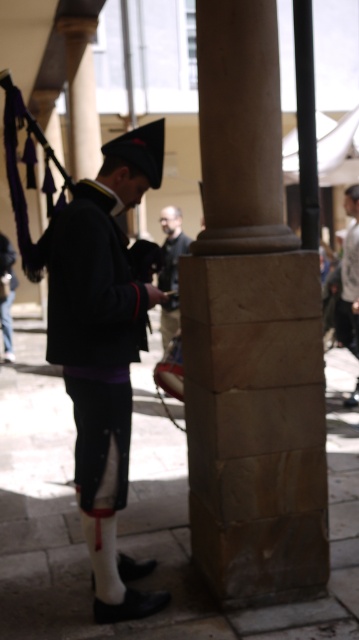
Question: Which point is closer to the camera taking this photo?

Choices:
 (A) (171, 244)
 (B) (258, 172)
 (C) (310, 230)

Answer: (B)

Question: Is brown stone pillar at center positioned at the back of black polished pole at center?

Choices:
 (A) no
 (B) yes

Answer: (A)

Question: Which point appears closest to the camera in this image?

Choices:
 (A) (100, 538)
 (B) (305, 244)
 (C) (170, 305)
 (D) (193, 532)

Answer: (A)

Question: Can you confirm if brown stone pillar at center is wider than black polished pole at center?

Choices:
 (A) yes
 (B) no

Answer: (A)

Question: Which point appears farthest from the camera in this image?

Choices:
 (A) click(x=297, y=74)
 (B) click(x=174, y=259)

Answer: (B)

Question: Can you confirm if matte black uniform at center is positioned to the left of black polished pole at center?

Choices:
 (A) no
 (B) yes

Answer: (B)